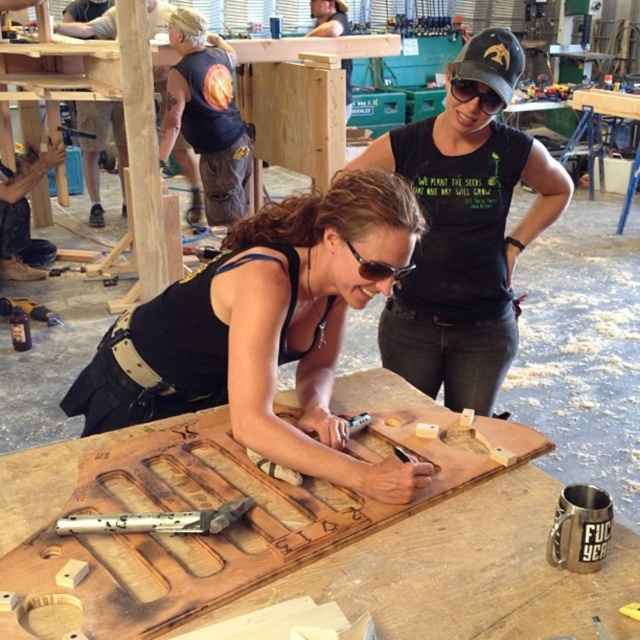
Is matte black tank top at center taller than black matte goggles at upper center?

Indeed, matte black tank top at center has a greater height compared to black matte goggles at upper center.

Is point (300, 426) in front of point (484, 93)?

Yes, it is.

You are a GUI agent. You are given a task and a screenshot of the screen. Output one action in this format:
    pyautogui.click(x=<x>, y=<y>)
    Task: Click on the matte black tank top at center
    The image size is (640, 640).
    Given the screenshot: What is the action you would take?
    pyautogui.click(x=262, y=332)

Who is shorter, black matte tank top at upper center or black matte goggles at upper center?

With less height is black matte goggles at upper center.

Describe the element at coordinates (465, 232) in the screenshot. I see `black matte tank top at upper center` at that location.

Locate an element on the screen. The height and width of the screenshot is (640, 640). black matte tank top at upper center is located at coordinates click(465, 232).

Which is more to the right, wooden board at center or metallic textured hammer at center?

From the viewer's perspective, wooden board at center appears more on the right side.

Can you confirm if wooden board at center is smaller than metallic textured hammer at center?

No, wooden board at center is not smaller than metallic textured hammer at center.

Where is `wooden board at center`? This screenshot has width=640, height=640. wooden board at center is located at coordinates (465, 572).